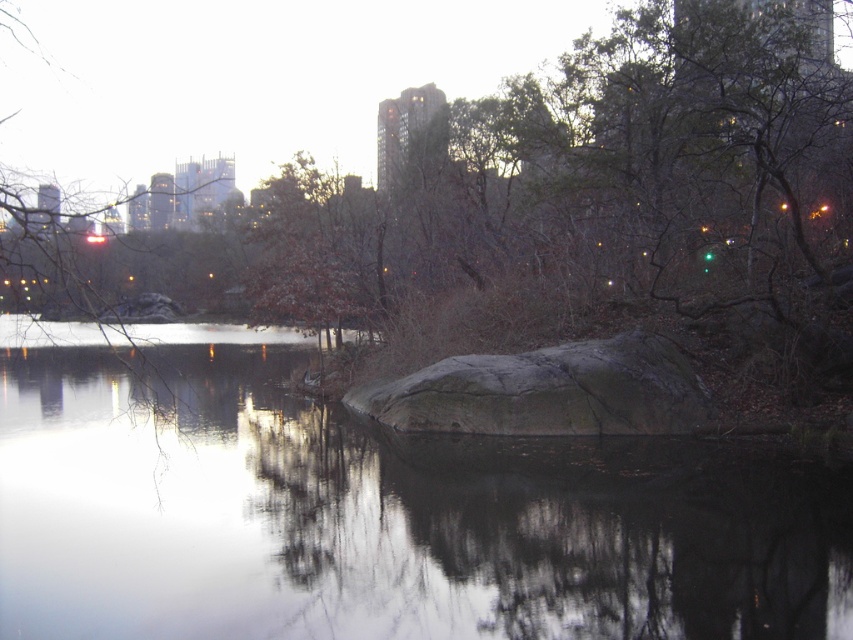
Which is above, smooth dark water at center or gray rough rock at center?

smooth dark water at center

Between smooth dark water at center and gray rough rock at center, which one appears on the right side from the viewer's perspective?

gray rough rock at center

Between point (167, 442) and point (525, 355), which one is positioned in front?

Point (167, 442) is more forward.

Image resolution: width=853 pixels, height=640 pixels. I want to click on smooth dark water at center, so click(374, 512).